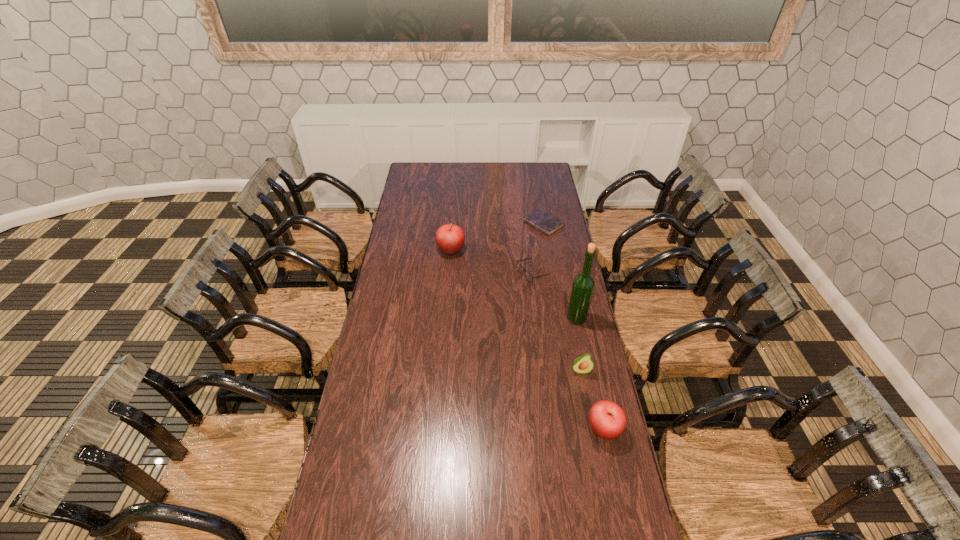
Point out which object is positioned as the fourth nearest to the fifth tallest object. Please provide its 2D coordinates. Your answer should be formatted as a tuple, i.e. [(x, y)], where the tuple contains the x and y coordinates of a point satisfying the conditions above.

[(583, 364)]

The width and height of the screenshot is (960, 540). In order to click on object that ranks as the closest to the second nearest object in this screenshot , I will do `click(607, 419)`.

Locate an element on the screen. blank area in the image that satisfies the following two spatial constraints: 1. with the lenses facing outward on the second shortest object; 2. on the left side of the liquor is located at coordinates (538, 318).

Identify the location of free space in the image that satisfies the following two spatial constraints: 1. with the lenses facing outward on the spectacles; 2. on the back side of the third nearest object. The width and height of the screenshot is (960, 540). (538, 318).

This screenshot has width=960, height=540. What are the coordinates of `vacant area that satisfies the following two spatial constraints: 1. with the lenses facing outward on the tallest object; 2. on the right side of the third farthest object` in the screenshot? It's located at (538, 318).